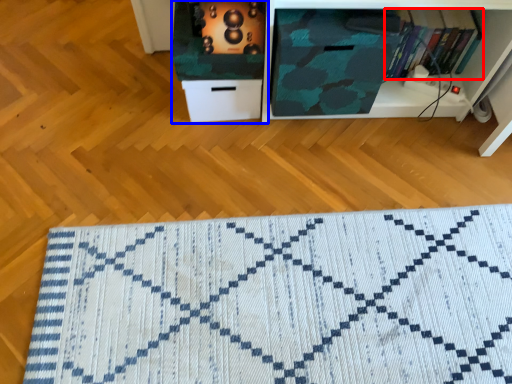
Question: Which point is closer to the camera, book (highlighted by a red box) or cabinetry (highlighted by a blue box)?

Choices:
 (A) book
 (B) cabinetry

Answer: (B)